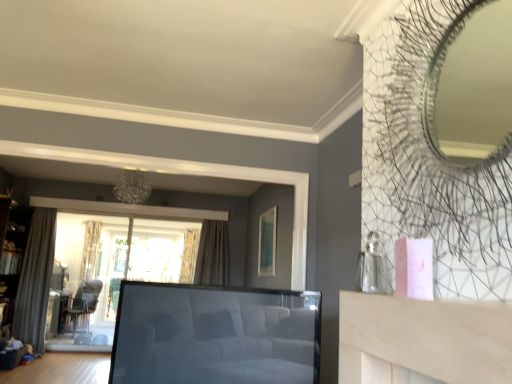
Locate an element on the screen. The height and width of the screenshot is (384, 512). empty space that is ontop of matte green picture frame at upper center (from a real-world perspective) is located at coordinates (269, 205).